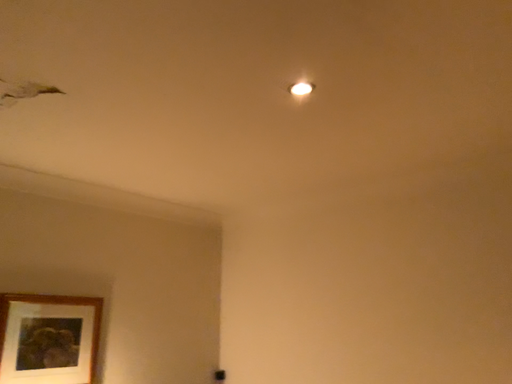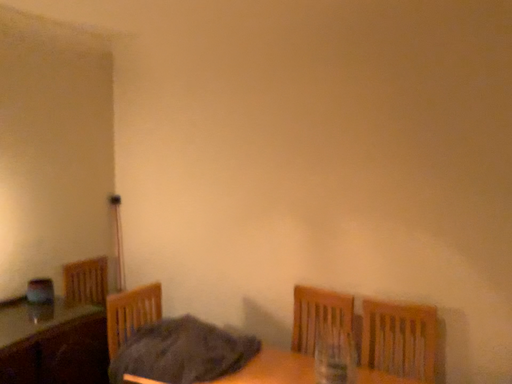
Question: Which way did the camera rotate in the video?

Choices:
 (A) rotated downward
 (B) rotated upward

Answer: (A)